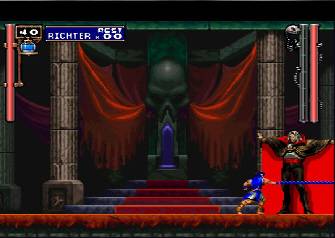
You are a GUI agent. You are given a task and a screenshot of the screen. Output one action in this format:
    pyautogui.click(x=<x>, y=<y>)
    Task: Click on the stairs
    Image resolution: width=335 pixels, height=238 pixels.
    Given the screenshot: What is the action you would take?
    pyautogui.click(x=174, y=208), pyautogui.click(x=174, y=200)